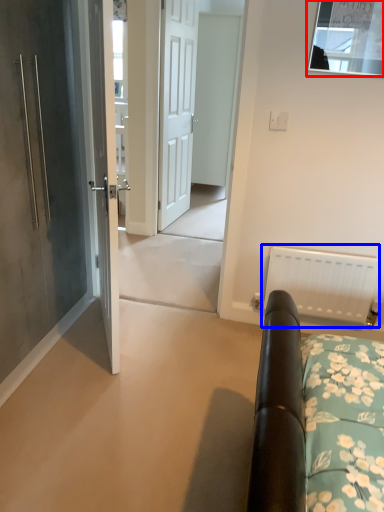
Question: Which of the following is the closest to the observer, window (highlighted by a red box) or radiator (highlighted by a blue box)?

Choices:
 (A) window
 (B) radiator

Answer: (A)